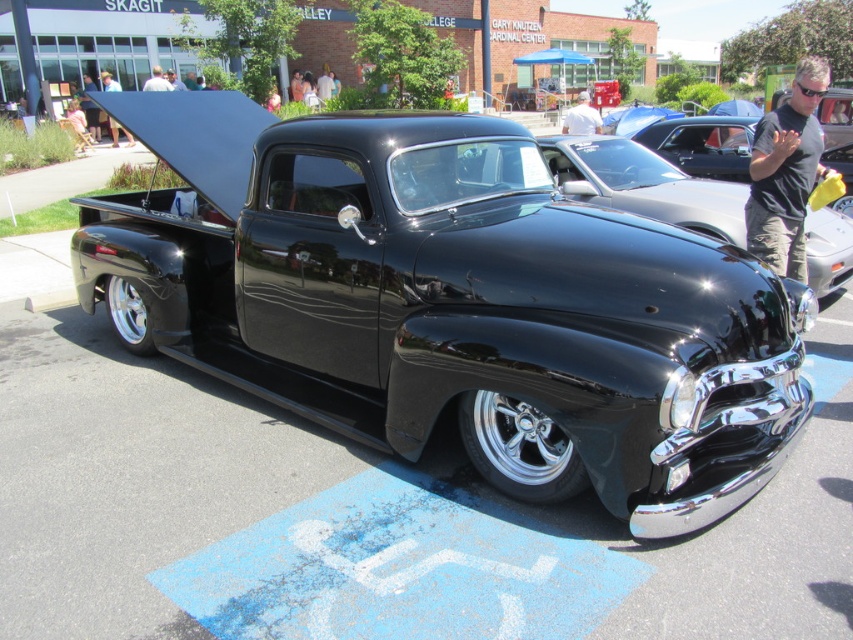
Is gray fabric umbrella at upper center positioned before white fabric shirt at upper center?

Yes.

Which is behind, point (582, 104) or point (160, 80)?

Point (582, 104)

Where is `gray fabric umbrella at upper center`? Image resolution: width=853 pixels, height=640 pixels. gray fabric umbrella at upper center is located at coordinates (582, 116).

Measure the distance between point (637, 209) and camera.

Point (637, 209) and camera are 6.71 meters apart.

Which is behind, point (718, 189) or point (167, 83)?

The point (167, 83) is more distant.

Where is `glossy black pickup truck at center`? glossy black pickup truck at center is located at coordinates (643, 184).

Find the location of `glossy black pickup truck at center`. glossy black pickup truck at center is located at coordinates (643, 184).

Which is behind, point (645, 172) or point (782, 129)?

The point (645, 172) is more distant.

Consider the image. Which is more to the right, glossy black pickup truck at center or black t-shirt at center?

black t-shirt at center

Image resolution: width=853 pixels, height=640 pixels. Find the location of `glossy black pickup truck at center`. glossy black pickup truck at center is located at coordinates (643, 184).

Identify the location of glossy black pickup truck at center. This screenshot has height=640, width=853. (643, 184).